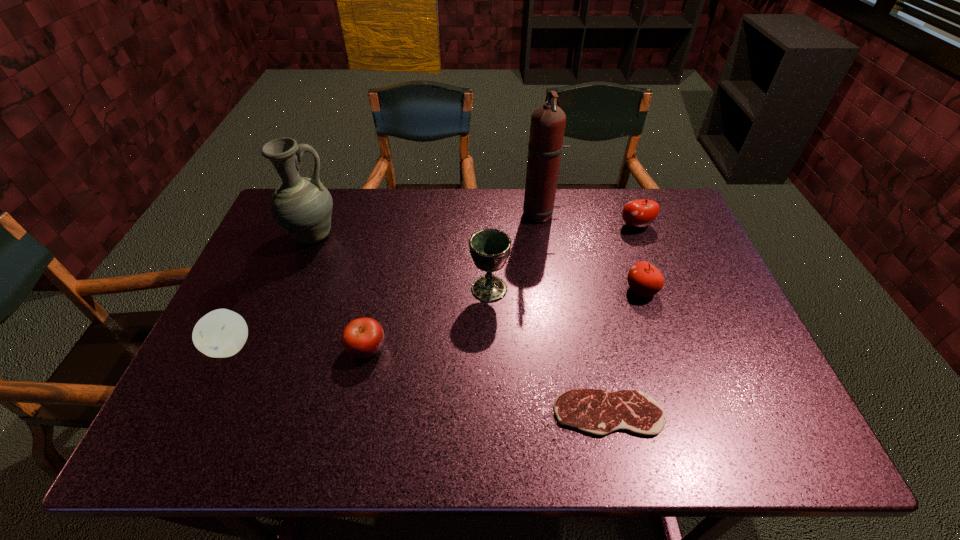
Identify the location of vacant space at the near edge. (315, 415).

Locate an element on the screen. Image resolution: width=960 pixels, height=540 pixels. free space at the right edge of the desktop is located at coordinates (714, 343).

You are a GUI agent. You are given a task and a screenshot of the screen. Output one action in this format:
    pyautogui.click(x=<x>, y=<y>)
    Task: Click on the free space at the far right corner of the desktop
    Image resolution: width=960 pixels, height=540 pixels.
    Given the screenshot: What is the action you would take?
    pyautogui.click(x=631, y=191)

This screenshot has width=960, height=540. In the image, there is a desktop. In order to click on vacant space at the near right corner in this screenshot , I will do `click(744, 454)`.

Find the location of a particular element. free space between the leftmost apple and the fire extinguisher is located at coordinates (386, 280).

Find the location of a particular element. free space that is in between the chalice and the second tallest object is located at coordinates (401, 262).

Locate an element on the screen. The width and height of the screenshot is (960, 540). vacant area that lies between the third nearest apple and the third apple from right to left is located at coordinates (504, 319).

Locate an element on the screen. The height and width of the screenshot is (540, 960). vacant point located between the farthest apple and the fire extinguisher is located at coordinates [588, 220].

In order to click on free space between the third apple from right to left and the seventh shortest object in this screenshot , I will do `click(340, 292)`.

You are a GUI agent. You are given a task and a screenshot of the screen. Output one action in this format:
    pyautogui.click(x=<x>, y=<y>)
    Task: Click on the unoccupied position between the third tallest object and the farthest apple
    
    Given the screenshot: What is the action you would take?
    pyautogui.click(x=563, y=258)